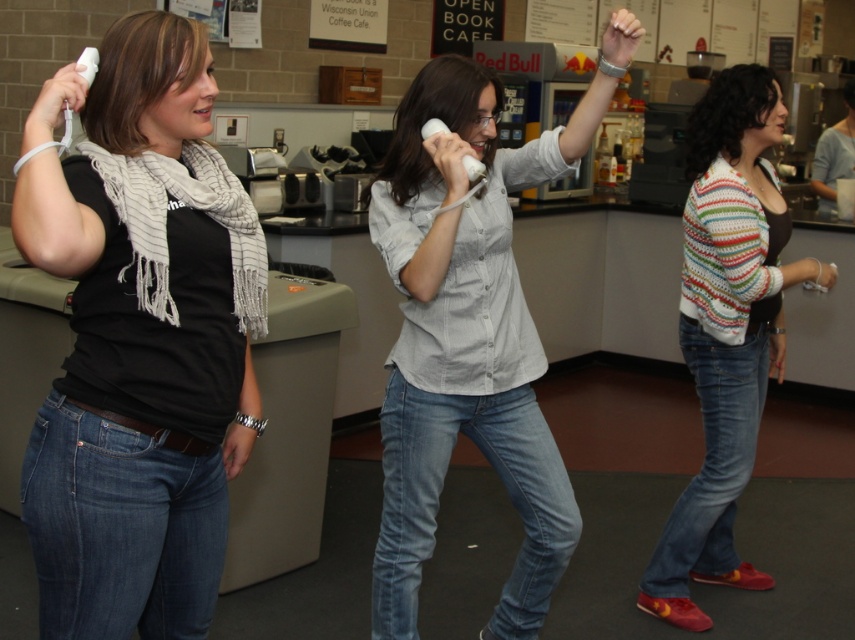
Based on the photo, looking at the scene, which object is positioned to the left of the other? The black matte scarf at left or the striped knit sweater at right?

The black matte scarf at left is positioned to the left of the striped knit sweater at right.

From the picture: What is the color of the clothing item where the point at coordinates (470, 332) is located?

The point at coordinates (470, 332) is located on denim jeans at center, which are typically blue or black in color.

What is the position of the denim jeans at center in the image?

The denim jeans at center is located at point (470,332).